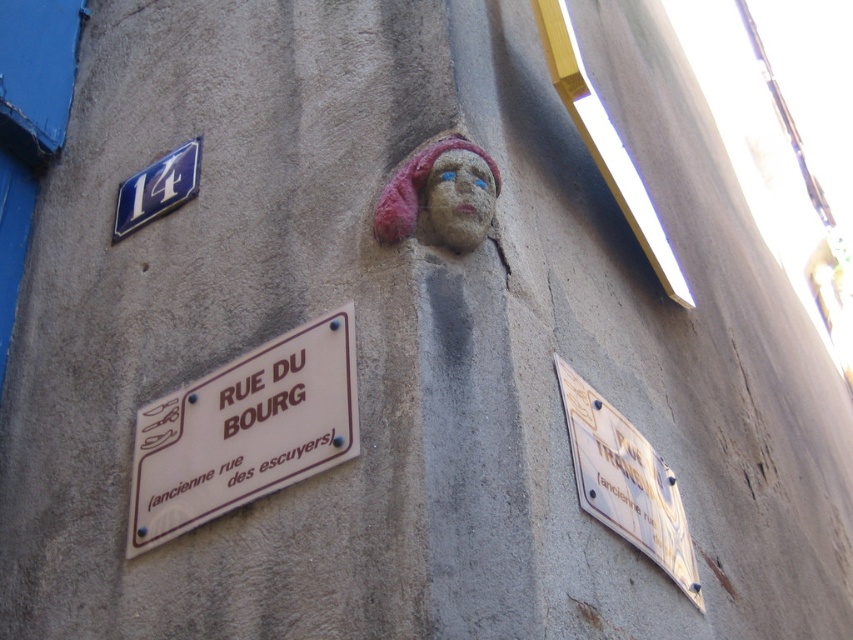
Between white plastic sign at lower left and white plastic sign at lower right, which one has less height?

white plastic sign at lower left

Does point (328, 458) come behind point (596, 408)?

No, it is not.

Does point (166, 490) come closer to viewer compared to point (662, 536)?

Yes, it is in front of point (662, 536).

What are the coordinates of `white plastic sign at lower left` in the screenshot? It's located at (244, 429).

Does stone face at upper center have a greater height compared to blue metallic sign at upper left?

No.

Which is more to the right, stone face at upper center or blue metallic sign at upper left?

From the viewer's perspective, stone face at upper center appears more on the right side.

Who is more distant from viewer, (466, 250) or (149, 173)?

The point (149, 173) is more distant.

Identify the location of stone face at upper center. (460, 196).

Is white plastic sign at lower left thinner than blue metallic sign at upper left?

No, white plastic sign at lower left is not thinner than blue metallic sign at upper left.

Between white plastic sign at lower left and blue metallic sign at upper left, which one is positioned lower?

white plastic sign at lower left

Locate an element on the screen. This screenshot has height=640, width=853. white plastic sign at lower left is located at coordinates (244, 429).